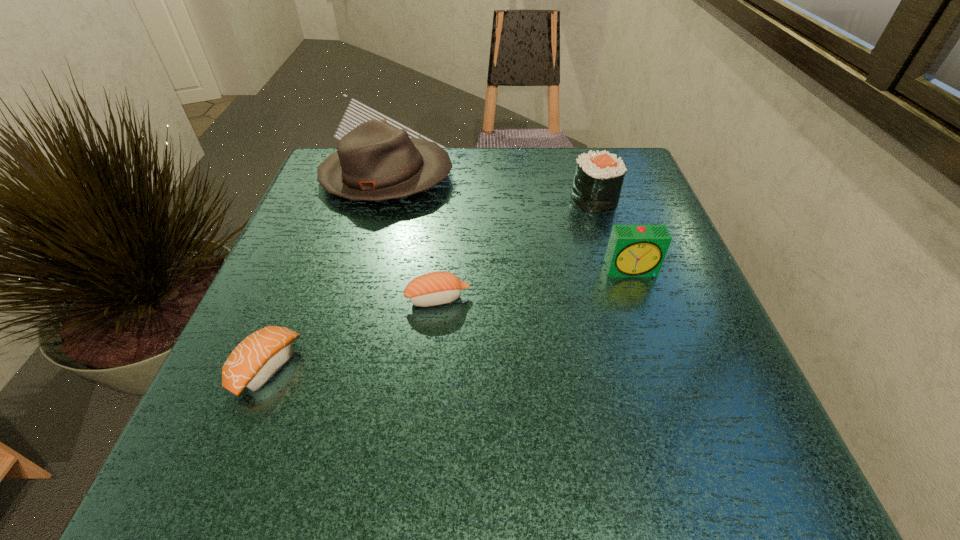
Locate an element on the screen. This screenshot has width=960, height=540. hat is located at coordinates (375, 161).

Find the location of a particular element. This screenshot has width=960, height=540. the tallest sushi is located at coordinates (598, 179).

The width and height of the screenshot is (960, 540). In order to click on the farthest sushi in this screenshot , I will do `click(598, 179)`.

Identify the location of the third nearest object. (633, 250).

At what (x,y) coordinates should I click in order to perform the action: click on the second nearest object. Please return your answer as a coordinate pair (x, y). This screenshot has width=960, height=540. Looking at the image, I should click on (436, 288).

Where is `the second nearest sushi`? This screenshot has width=960, height=540. the second nearest sushi is located at coordinates (436, 288).

You are a GUI agent. You are given a task and a screenshot of the screen. Output one action in this format:
    pyautogui.click(x=<x>, y=<y>)
    Task: Click on the nearest object
    The image size is (960, 540).
    Given the screenshot: What is the action you would take?
    pyautogui.click(x=255, y=360)

Image resolution: width=960 pixels, height=540 pixels. Find the location of `the leftmost sushi`. the leftmost sushi is located at coordinates (255, 360).

The width and height of the screenshot is (960, 540). Identify the location of free region located 0.110m on the decorative side of the hat. (499, 178).

This screenshot has width=960, height=540. What are the coordinates of `vacant space located on the front of the farthest sushi` in the screenshot? It's located at (623, 288).